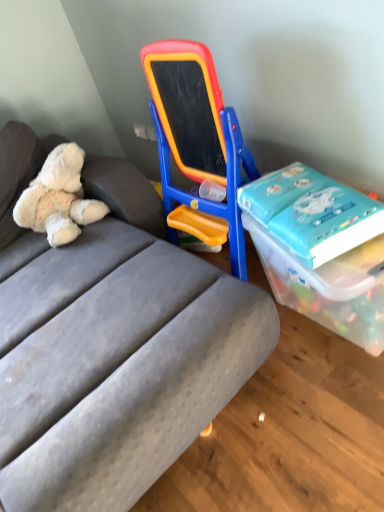
Question: From the image's perspective, is transparent plastic box at right above blue glossy book at right?

Choices:
 (A) yes
 (B) no

Answer: (B)

Question: Is transparent plastic box at right at the right side of blue glossy book at right?

Choices:
 (A) yes
 (B) no

Answer: (A)

Question: Considering the relative sizes of transparent plastic box at right and blue glossy book at right in the image provided, is transparent plastic box at right taller than blue glossy book at right?

Choices:
 (A) yes
 (B) no

Answer: (A)

Question: Is transparent plastic box at right located outside blue glossy book at right?

Choices:
 (A) no
 (B) yes

Answer: (B)

Question: Is transparent plastic box at right surrounding blue glossy book at right?

Choices:
 (A) no
 (B) yes

Answer: (A)

Question: From a real-world perspective, relative to white plush teddy bear at left, is blue glossy book at right vertically above or below?

Choices:
 (A) above
 (B) below

Answer: (B)

Question: Is point (319, 229) positioned closer to the camera than point (59, 243)?

Choices:
 (A) farther
 (B) closer

Answer: (B)

Question: From their relative heights in the image, would you say blue glossy book at right is taller or shorter than white plush teddy bear at left?

Choices:
 (A) short
 (B) tall

Answer: (A)

Question: Considering the positions of blue glossy book at right and white plush teddy bear at left in the image, is blue glossy book at right wider or thinner than white plush teddy bear at left?

Choices:
 (A) thin
 (B) wide

Answer: (A)

Question: Does point (120, 425) appear closer or farther from the camera than point (48, 228)?

Choices:
 (A) farther
 (B) closer

Answer: (B)

Question: In terms of width, does gray fabric studio couch at center look wider or thinner when compared to white plush teddy bear at left?

Choices:
 (A) thin
 (B) wide

Answer: (B)

Question: Considering the positions of gray fabric studio couch at center and white plush teddy bear at left in the image, is gray fabric studio couch at center taller or shorter than white plush teddy bear at left?

Choices:
 (A) tall
 (B) short

Answer: (A)

Question: Looking at the image, does gray fabric studio couch at center seem bigger or smaller compared to white plush teddy bear at left?

Choices:
 (A) big
 (B) small

Answer: (A)

Question: Choose the correct answer: Is gray fabric studio couch at center inside transparent plastic box at right or outside it?

Choices:
 (A) inside
 (B) outside

Answer: (B)

Question: From a real-world perspective, relative to transparent plastic box at right, is gray fabric studio couch at center vertically above or below?

Choices:
 (A) below
 (B) above

Answer: (B)